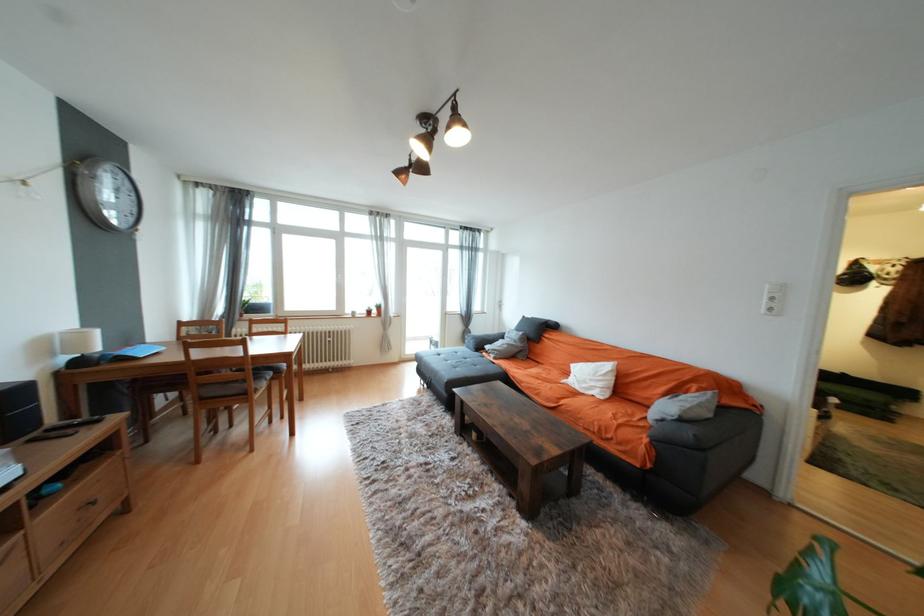
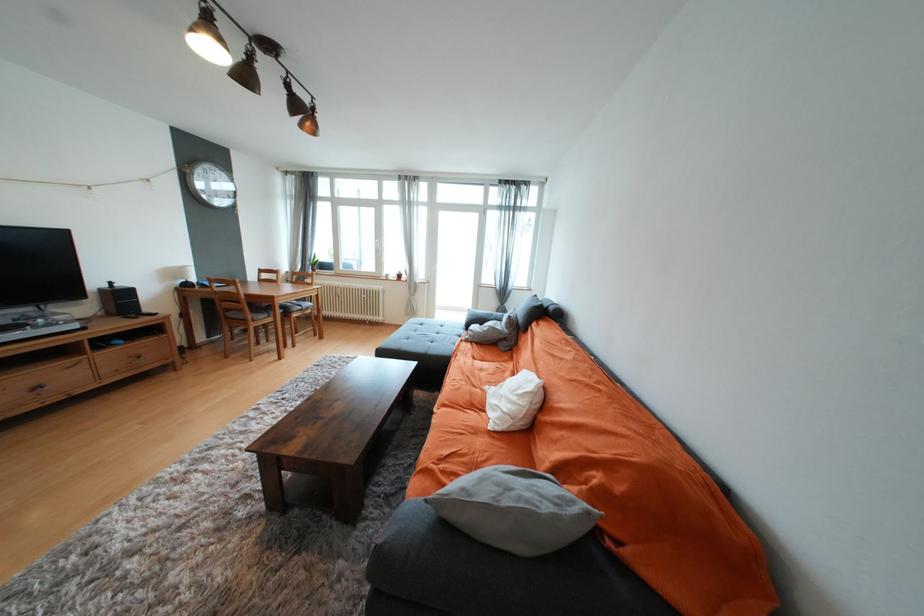
The point at (596,394) is marked in the first image. Where is the corresponding point in the second image?

(496, 416)